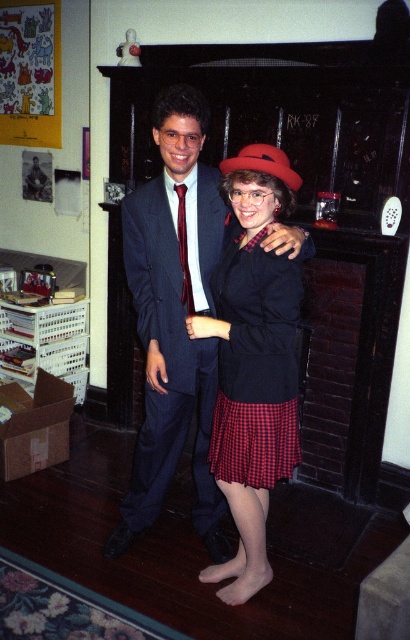
Consider the image. You are a photographer adjusting the camera focus. The red checkered skirt at center and the burgundy silk tie at center are both in the frame. Which object should you focus on first if you want to ensure the larger one is sharp?

The red checkered skirt at center is bigger than the burgundy silk tie at center, so you should focus on the red checkered skirt at center first to ensure the larger object is sharp.

You are a photographer adjusting your camera settings. You need to focus on the dark blue wool suit at center. What are the coordinates where you should aim your camera?

The coordinates for the dark blue wool suit at center are at point [166,364].